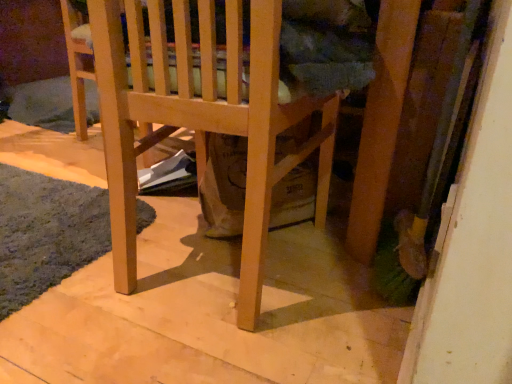
Locate an element on the screen. Image resolution: width=512 pixels, height=384 pixels. natural wood chair at center is located at coordinates (201, 119).

What do you see at coordinates (201, 119) in the screenshot?
I see `natural wood chair at center` at bounding box center [201, 119].

This screenshot has width=512, height=384. What are the coordinates of `soft gray carpet at lower left` in the screenshot? It's located at (46, 233).

This screenshot has height=384, width=512. Describe the element at coordinates (46, 233) in the screenshot. I see `soft gray carpet at lower left` at that location.

The width and height of the screenshot is (512, 384). What are the coordinates of `natural wood chair at center` in the screenshot? It's located at (201, 119).

Between natural wood chair at center and soft gray carpet at lower left, which one appears on the right side from the viewer's perspective?

Positioned to the right is natural wood chair at center.

Does natural wood chair at center come behind soft gray carpet at lower left?

No, natural wood chair at center is closer to the camera.

Considering the positions of points (251, 307) and (41, 265), is point (251, 307) farther from camera compared to point (41, 265)?

That is False.

From the image's perspective, is natural wood chair at center on top of soft gray carpet at lower left?

Correct, natural wood chair at center appears higher than soft gray carpet at lower left in the image.

From a real-world perspective, is natural wood chair at center positioned above or below soft gray carpet at lower left?

In terms of real-world spatial position, natural wood chair at center is above soft gray carpet at lower left.

Can you confirm if natural wood chair at center is thinner than soft gray carpet at lower left?

No.

From their relative heights in the image, would you say natural wood chair at center is taller or shorter than soft gray carpet at lower left?

natural wood chair at center is taller than soft gray carpet at lower left.

Is natural wood chair at center bigger than soft gray carpet at lower left?

Indeed, natural wood chair at center has a larger size compared to soft gray carpet at lower left.

In the scene shown: Is natural wood chair at center completely or partially outside of soft gray carpet at lower left?

Absolutely, natural wood chair at center is external to soft gray carpet at lower left.

Is natural wood chair at center touching soft gray carpet at lower left?

No, natural wood chair at center is not making contact with soft gray carpet at lower left.

Does natural wood chair at center turn towards soft gray carpet at lower left?

No, natural wood chair at center does not turn towards soft gray carpet at lower left.

Measure the distance from natural wood chair at center to soft gray carpet at lower left.

They are 15.27 inches apart.

Find the location of a particular element. The image size is (512, 384). mat that is on the left side of natural wood chair at center is located at coordinates (46, 233).

Can you confirm if soft gray carpet at lower left is positioned to the right of natural wood chair at center?

No.

Is soft gray carpet at lower left in front of or behind natural wood chair at center in the image?

Clearly, soft gray carpet at lower left is behind natural wood chair at center.

Is point (62, 200) positioned after point (127, 235)?

Yes, point (62, 200) is behind point (127, 235).

From the image's perspective, is soft gray carpet at lower left beneath natural wood chair at center?

Indeed, from the image's perspective, soft gray carpet at lower left is shown beneath natural wood chair at center.

From a real-world perspective, which object stands above the other?

natural wood chair at center, from a real-world perspective.

Is soft gray carpet at lower left wider or thinner than natural wood chair at center?

In the image, soft gray carpet at lower left appears to be more narrow than natural wood chair at center.

Does soft gray carpet at lower left have a greater height compared to natural wood chair at center?

Incorrect, the height of soft gray carpet at lower left is not larger of that of natural wood chair at center.

Between soft gray carpet at lower left and natural wood chair at center, which one has larger size?

natural wood chair at center.

Is soft gray carpet at lower left surrounding natural wood chair at center?

No, soft gray carpet at lower left does not contain natural wood chair at center.

Is soft gray carpet at lower left not near natural wood chair at center?

soft gray carpet at lower left is actually quite close to natural wood chair at center.

Is soft gray carpet at lower left oriented away from natural wood chair at center?

That's not correct — soft gray carpet at lower left is not looking away from natural wood chair at center.

Measure the distance between soft gray carpet at lower left and natural wood chair at center.

15.27 inches.

Find the location of a particular element. furniture above the soft gray carpet at lower left (from a real-world perspective) is located at coordinates (201, 119).

The width and height of the screenshot is (512, 384). In order to click on furniture above the soft gray carpet at lower left (from the image's perspective) in this screenshot , I will do `click(201, 119)`.

What are the coordinates of `mat behind the natural wood chair at center` in the screenshot? It's located at (46, 233).